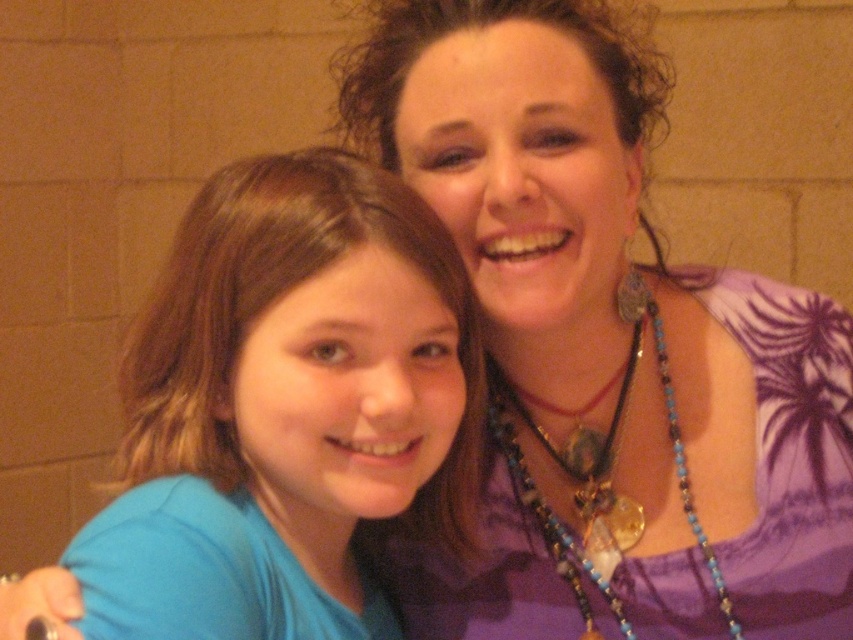
You are an interior designer working on a project and need to place a new decoration at the exact center of the room. The room has a purple fabric at center. Where should you place the decoration?

The purple fabric at center is located at point (619, 317), so you should place the decoration at that exact coordinate to ensure it is at the center of the room.

You are an interior designer observing this scene. You need to place a decorative item between the blue fabric shirt at center and the blue beaded necklace at upper right. Based on their positions, which object should the decorative item be placed closer to?

The blue fabric shirt at center is positioned on the left side of blue beaded necklace at upper right, so the decorative item should be placed closer to the blue fabric shirt at center since it is located to the left of the necklace.

Consider the image. You are a fashion designer observing this image. You need to determine which item would require more fabric to create between the blue fabric shirt at center and the blue beaded necklace at upper right. Which one would it be?

The blue fabric shirt at center is larger in size than the blue beaded necklace at upper right, so it would require more fabric to create.